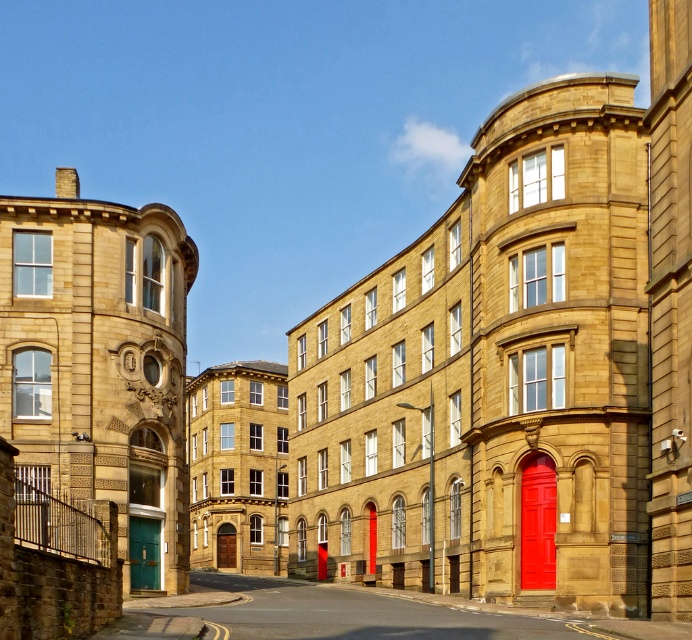
You are a delivery person trying to find the correct address. You see a matte red door at center and a green matte door at lower left. Which door is above the other?

The matte red door at center is positioned over the green matte door at lower left, meaning it is above it.

You are a delivery person trying to decide which door to use for a large package. The matte red door at center and the green matte door at lower left are both options. Based on their size, which door might be more suitable for the package?

The green matte door at lower left occupies more space than the matte red door at center, so it is more suitable for the large package.

You are standing on the street looking at the row of Victorian buildings. You notice two points marked on the closest building. One is at point (525, 552) and the other at point (140, 552). Which point is closer to you?

Point (140, 552) is closer to you because it is nearer to the camera than point (525, 552).